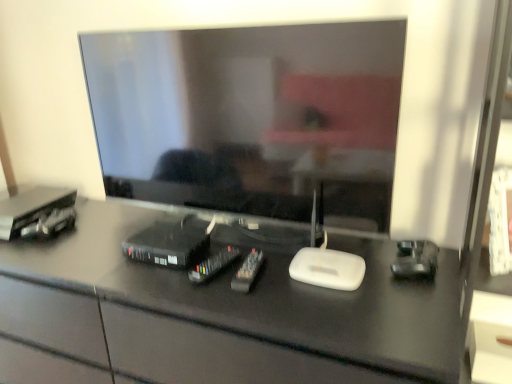
Where is `vacant space in front of black plastic remote controls at center, the 1th equipment when ordered from right to left`? The width and height of the screenshot is (512, 384). vacant space in front of black plastic remote controls at center, the 1th equipment when ordered from right to left is located at coordinates (273, 310).